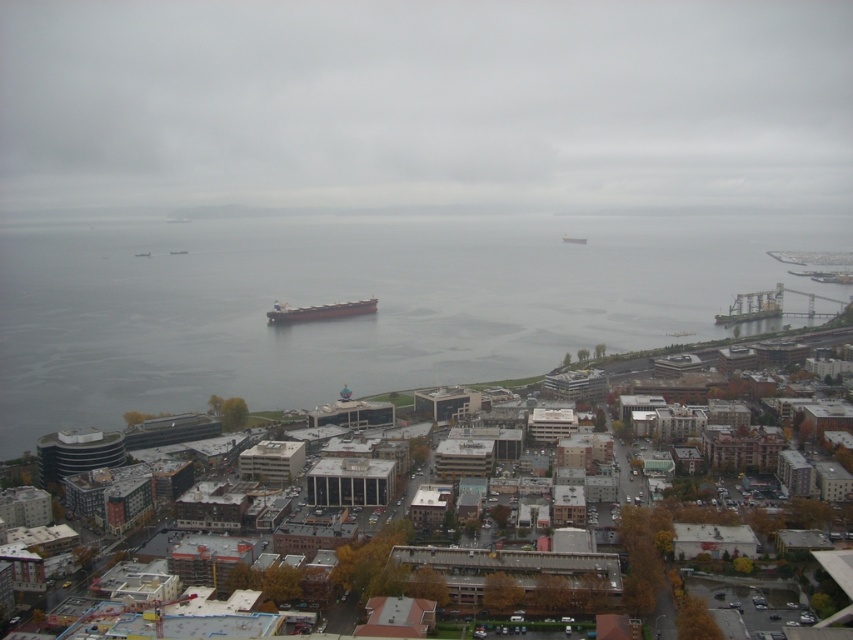
Question: Which of the following is the farthest from the observer?

Choices:
 (A) (99, 371)
 (B) (566, 241)
 (C) (705, 352)

Answer: (B)

Question: Is smooth concrete harbor at center closer to the viewer compared to gray matte cargo ship at center?

Choices:
 (A) no
 (B) yes

Answer: (B)

Question: Based on their relative distances, which object is farther from the smooth concrete harbor at center?

Choices:
 (A) gray matte cargo ship at center
 (B) metallic gray ship at center
 (C) gray water at center
 (D) gray cloudy sky at upper center

Answer: (D)

Question: Does gray cloudy sky at upper center appear on the left side of gray matte cargo ship at center?

Choices:
 (A) yes
 (B) no

Answer: (A)

Question: Which object appears farthest from the camera in this image?

Choices:
 (A) gray water at center
 (B) gray matte cargo ship at center
 (C) metallic gray ship at center
 (D) gray cloudy sky at upper center

Answer: (B)

Question: Is gray water at center below smooth concrete harbor at center?

Choices:
 (A) yes
 (B) no

Answer: (B)